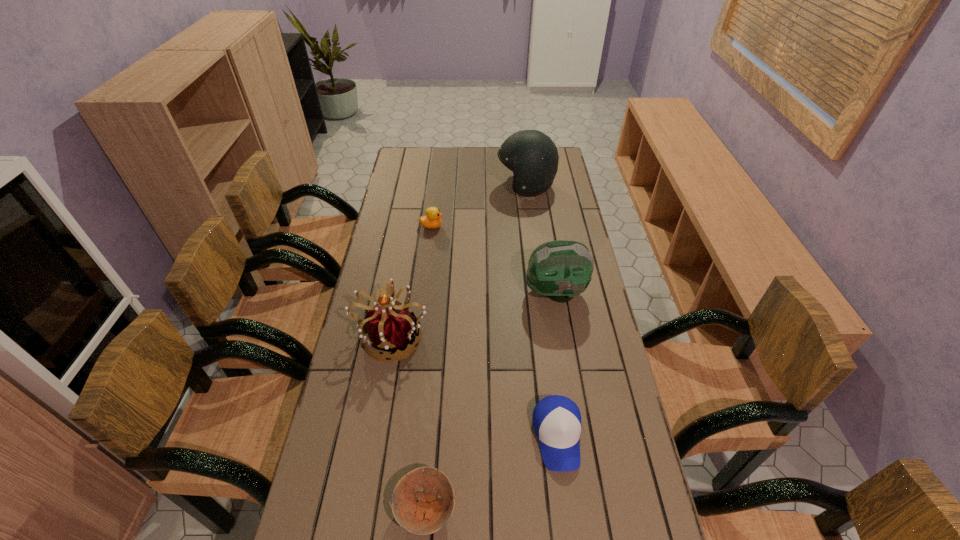
At what (x,y) coordinates should I click in order to perform the action: click on the farthest object. Please return your answer as a coordinate pair (x, y). Looking at the image, I should click on (532, 156).

This screenshot has height=540, width=960. Identify the location of the farther football helmet. (532, 156).

This screenshot has height=540, width=960. Find the location of `tiara`. tiara is located at coordinates (391, 329).

Identify the location of the nearer football helmet. Image resolution: width=960 pixels, height=540 pixels. (561, 270).

Locate an element on the screen. The height and width of the screenshot is (540, 960). duckling is located at coordinates (432, 219).

This screenshot has width=960, height=540. I want to click on baseball cap, so click(556, 419).

The width and height of the screenshot is (960, 540). In order to click on free region located at the face opening of the taller football helmet in this screenshot , I will do `click(469, 186)`.

Where is `vacant space located 0.190m at the face opening of the taller football helmet`? vacant space located 0.190m at the face opening of the taller football helmet is located at coordinates (453, 186).

I want to click on vacant position located at the face opening of the taller football helmet, so (x=421, y=186).

Locate an element on the screen. blank space located on the front-facing side of the tiara is located at coordinates (366, 486).